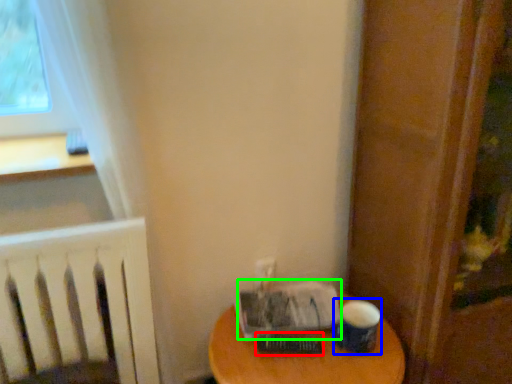
Question: Based on their relative distances, which object is nearer to paperback book (highlighted by a red box)? Choose from paper cup (highlighted by a blue box) and paperback book (highlighted by a green box).

Choices:
 (A) paper cup
 (B) paperback book

Answer: (B)